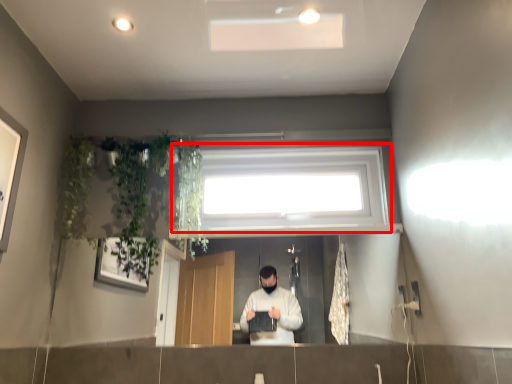
Question: Observing the image, what is the correct spatial positioning of window (annotated by the red box) in reference to plant?

Choices:
 (A) left
 (B) right

Answer: (B)